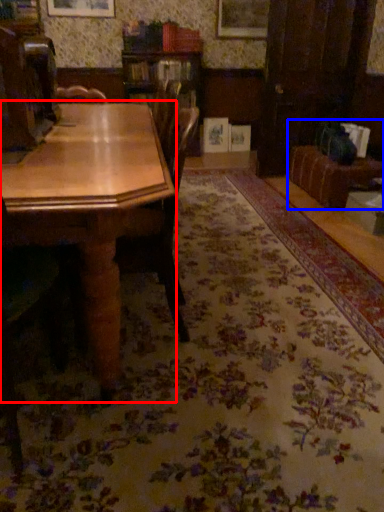
Question: Which object appears farthest to the camera in this image, table (highlighted by a red box) or couch (highlighted by a blue box)?

Choices:
 (A) table
 (B) couch

Answer: (B)